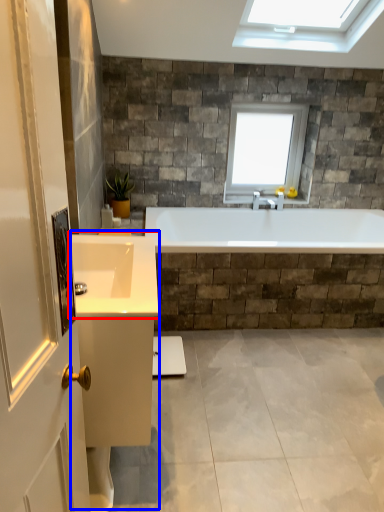
Question: Which object is closer to the camera taking this photo, sink (highlighted by a red box) or vanity (highlighted by a blue box)?

Choices:
 (A) sink
 (B) vanity

Answer: (A)